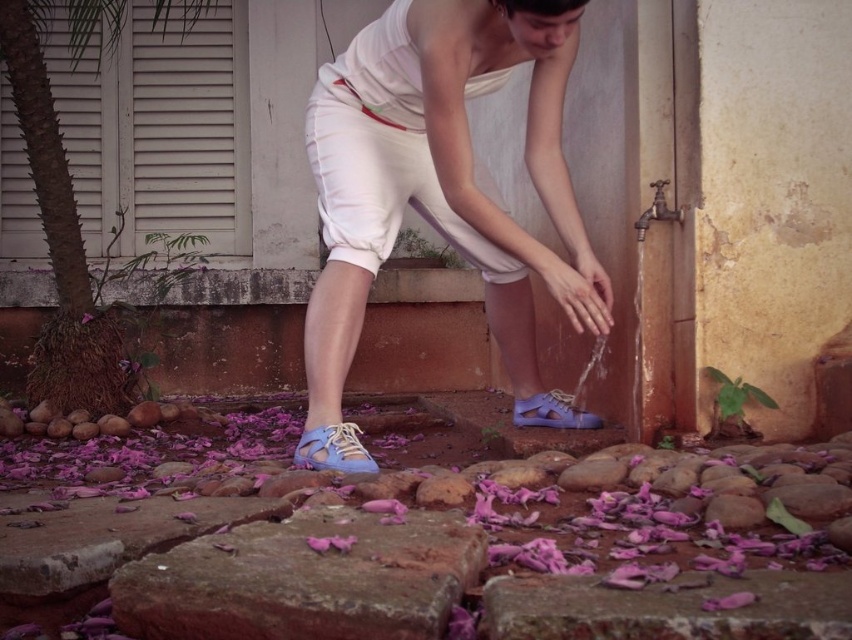
Does matte white shorts at center appear under matte purple shoe at lower center?

No.

Does matte white shorts at center appear on the right side of matte purple shoe at lower center?

In fact, matte white shorts at center is to the left of matte purple shoe at lower center.

You are a GUI agent. You are given a task and a screenshot of the screen. Output one action in this format:
    pyautogui.click(x=<x>, y=<y>)
    Task: Click on the matte white shorts at center
    The height and width of the screenshot is (640, 852).
    Given the screenshot: What is the action you would take?
    pyautogui.click(x=441, y=173)

The width and height of the screenshot is (852, 640). I want to click on matte white shorts at center, so click(x=441, y=173).

How far apart are matte blue sandal at lower left and matte purple shoe at lower center?

They are 31.35 inches apart.

Can you confirm if matte blue sandal at lower left is shorter than matte purple shoe at lower center?

Correct, matte blue sandal at lower left is not as tall as matte purple shoe at lower center.

Find the location of a particular element. matte blue sandal at lower left is located at coordinates (334, 449).

This screenshot has width=852, height=640. I want to click on matte blue sandal at lower left, so click(x=334, y=449).

Is matte blue sandal at lower left in front of purple matte flower at lower left?

Yes.

Is matte blue sandal at lower left bigger than purple matte flower at lower left?

Yes.

Between point (338, 456) and point (83, 317), which one is positioned in front?

Point (338, 456) is more forward.

At what (x,y) coordinates should I click in order to perform the action: click on matte blue sandal at lower left. Please return your answer as a coordinate pair (x, y). Looking at the image, I should click on (334, 449).